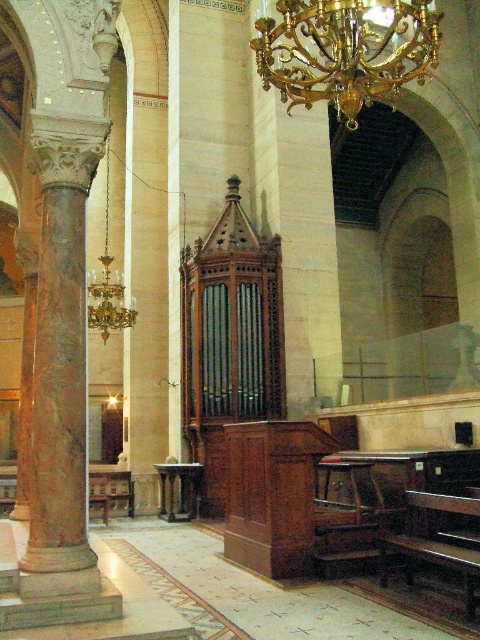
Is marble column at left positioned before gold/gilded metal chandelier at upper center?

Yes.

Can you confirm if marble column at left is positioned to the left of gold/gilded metal chandelier at upper center?

Correct, you'll find marble column at left to the left of gold/gilded metal chandelier at upper center.

Locate an element on the screen. This screenshot has width=480, height=640. marble column at left is located at coordinates (60, 362).